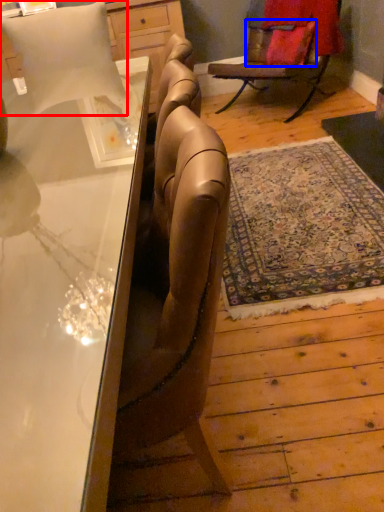
Question: Which of the following is the closest to the observer, pillow (highlighted by a red box) or pillow (highlighted by a blue box)?

Choices:
 (A) pillow
 (B) pillow

Answer: (A)